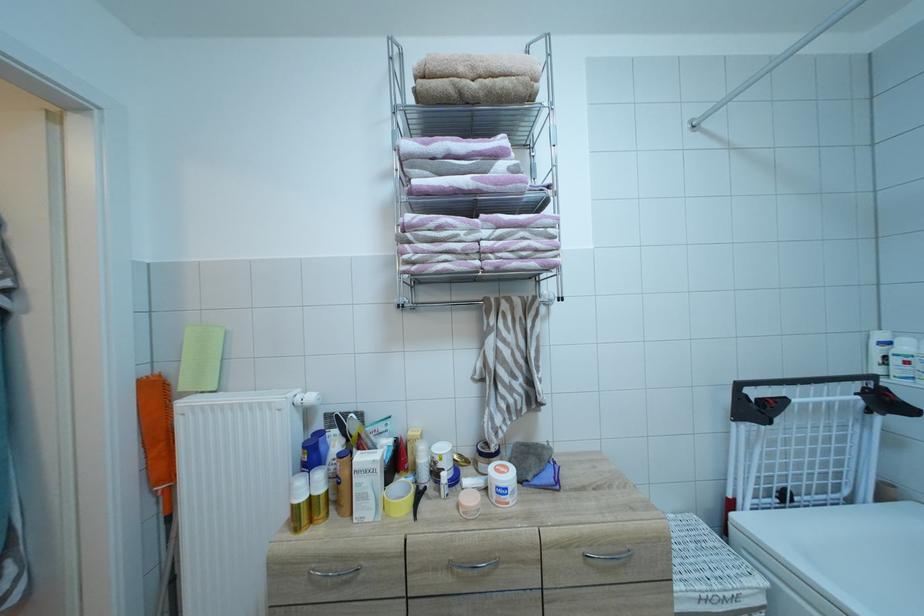
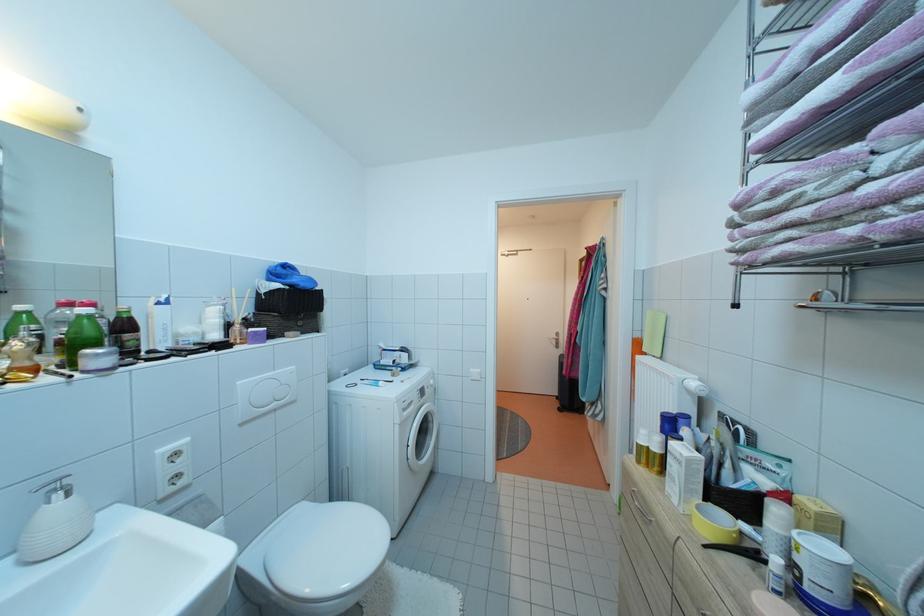
In the second image, find the point that corresponds to [446,471] in the first image.

(805, 565)